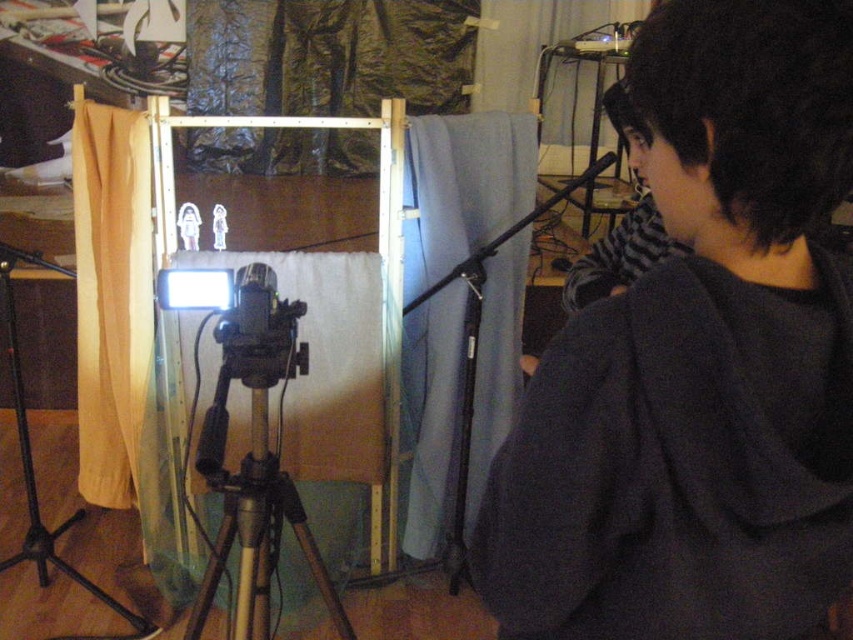
You are setting up a camera for a stop motion project and need to ensure that the dark gray hoodie at upper right is visible in the shot. The black matte tripod at lower left is blocking part of the view. How can you adjust the camera setup to include both objects in the frame?

Move the black matte tripod at lower left so that it is no longer blocking the dark gray hoodie at upper right, allowing both objects to be visible in the frame.

Based on the photo, you are setting up a camera for a stop motion project and need to adjust the position of the dark gray hoodie at upper right and the wooden tripod at center. Which object is located to the right of the other?

The dark gray hoodie at upper right is positioned on the right side of wooden tripod at center.

You are setting up a stop motion animation scene and need to position two markers for tracking. The markers are at point coordinates point [225,358] and point [260,340]. From the camera perspective, which marker is closer to the camera?

Point [260,340] is closer to the camera because point [225,358] is behind it.